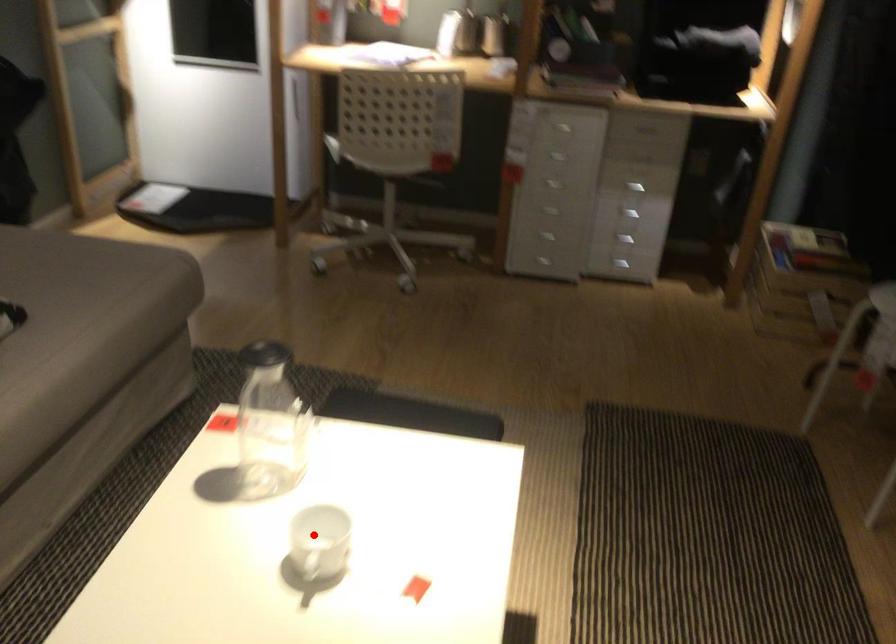
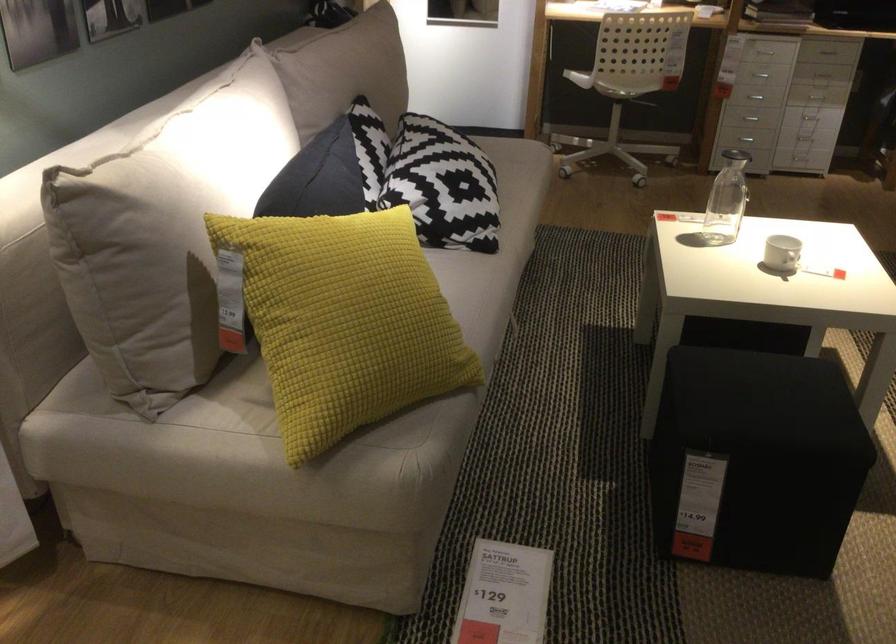
Question: I am providing you with two images of the same scene from different viewpoints. Given a red point in image1, look at the same physical point in image2. Is it:

Choices:
 (A) Closer to the viewpoint
 (B) Farther from the viewpoint

Answer: (B)